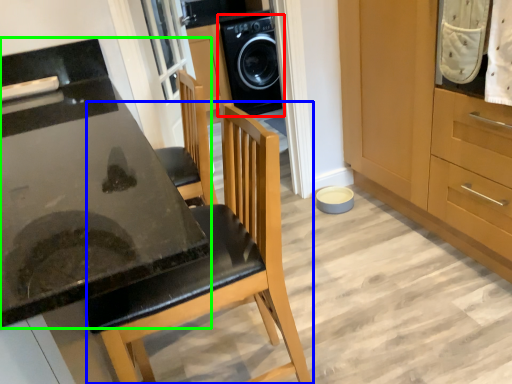
Question: Which is nearer to the home appliance (highlighted by a red box)? chair (highlighted by a blue box) or countertop (highlighted by a green box).

Choices:
 (A) chair
 (B) countertop

Answer: (B)